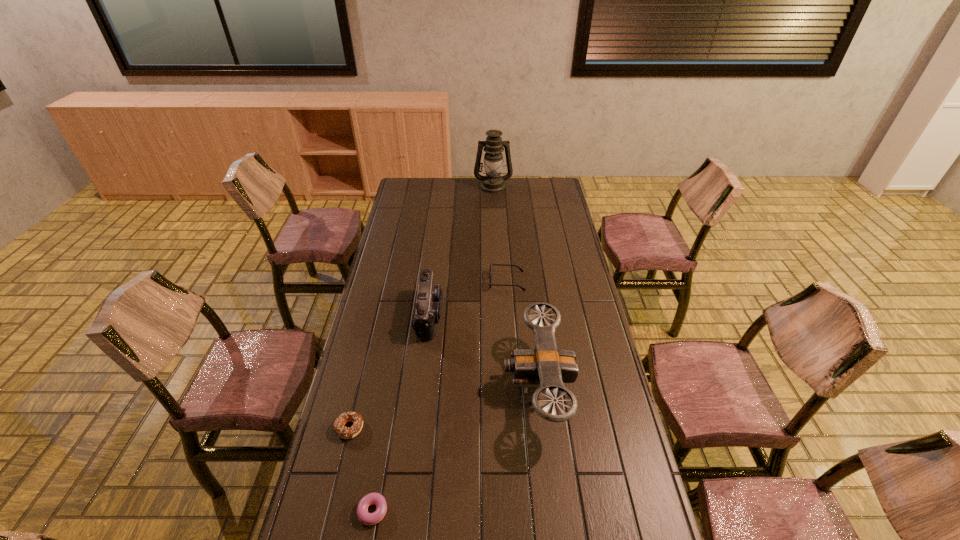
What are the coordinates of `object present at the right edge` in the screenshot? It's located at (545, 365).

At what (x,y) coordinates should I click in order to perform the action: click on vacant region at the far edge of the desktop. Please return your answer as a coordinate pair (x, y). This screenshot has height=540, width=960. Looking at the image, I should click on (441, 199).

Where is `blank space at the left edge of the desktop`? The height and width of the screenshot is (540, 960). blank space at the left edge of the desktop is located at coordinates (418, 227).

Where is `vacant space at the right edge of the desktop`? The height and width of the screenshot is (540, 960). vacant space at the right edge of the desktop is located at coordinates (577, 288).

The height and width of the screenshot is (540, 960). Identify the location of vacant space at the far right corner of the desktop. (554, 198).

The image size is (960, 540). I want to click on vacant space that is in between the shorter doughnut and the camcorder, so click(x=400, y=413).

The width and height of the screenshot is (960, 540). I want to click on empty location between the fifth shortest object and the leftmost object, so click(x=444, y=407).

The image size is (960, 540). In order to click on vacant space that is in between the shorter doughnut and the third shortest object in this screenshot , I will do `click(440, 396)`.

This screenshot has height=540, width=960. Find the location of `unoccupied position between the second tallest object and the spectacles`. unoccupied position between the second tallest object and the spectacles is located at coordinates (522, 334).

The width and height of the screenshot is (960, 540). Find the location of `blank region between the nearer doughnut and the third shortest object`. blank region between the nearer doughnut and the third shortest object is located at coordinates (440, 396).